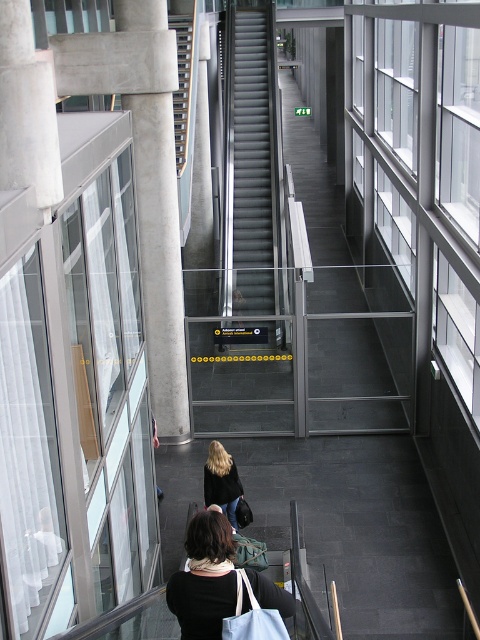
Question: Observing the image, what is the correct spatial positioning of black fabric bag at lower center in reference to blonde hair at center?

Choices:
 (A) left
 (B) right

Answer: (B)

Question: Among these objects, which one is nearest to the camera?

Choices:
 (A) metallic gray stairs at center
 (B) white concrete pillar at left

Answer: (B)

Question: Is smooth gray stairs at center closer to the viewer compared to metallic gray stairs at center?

Choices:
 (A) no
 (B) yes

Answer: (B)

Question: Which point is farther to the camera?

Choices:
 (A) (146, 128)
 (B) (188, 28)
 (C) (239, 76)

Answer: (C)

Question: Which object appears closest to the camera in this image?

Choices:
 (A) metallic gray stairs at center
 (B) white concrete pillar at left
 (C) blonde hair at center
 (D) smooth gray stairs at center

Answer: (C)

Question: Is smooth gray stairs at center positioned at the back of blonde hair at center?

Choices:
 (A) no
 (B) yes

Answer: (B)